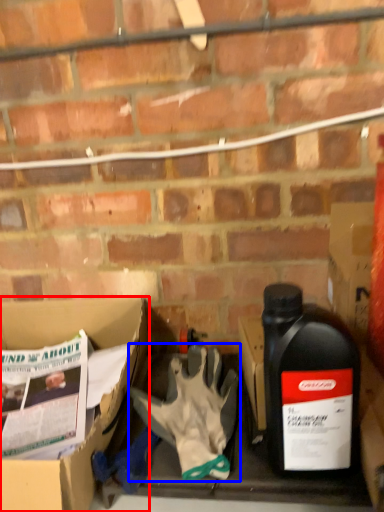
Question: Which point is further to the camera, box (highlighted by a red box) or glove (highlighted by a blue box)?

Choices:
 (A) box
 (B) glove

Answer: (B)